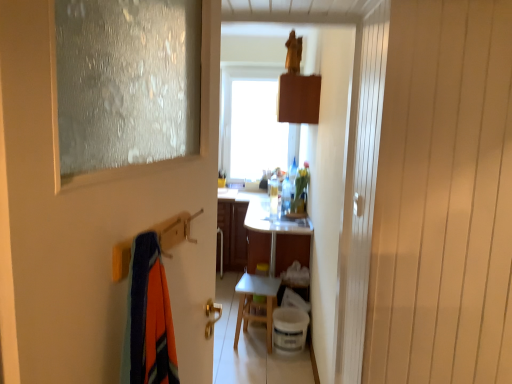
Question: Is translucent plastic bottle at center shorter than frosted glass door at left?

Choices:
 (A) yes
 (B) no

Answer: (A)

Question: From the image's perspective, would you say translucent plastic bottle at center is shown under frosted glass door at left?

Choices:
 (A) yes
 (B) no

Answer: (B)

Question: From the image's perspective, does translucent plastic bottle at center appear higher than frosted glass door at left?

Choices:
 (A) no
 (B) yes

Answer: (B)

Question: Can you confirm if translucent plastic bottle at center is taller than frosted glass door at left?

Choices:
 (A) yes
 (B) no

Answer: (B)

Question: Does translucent plastic bottle at center have a lesser width compared to frosted glass door at left?

Choices:
 (A) no
 (B) yes

Answer: (A)

Question: Is point (281, 200) positioned closer to the camera than point (264, 238)?

Choices:
 (A) closer
 (B) farther

Answer: (B)

Question: From a real-world perspective, is translucent plastic bottle at center positioned above or below white glossy vanity at center?

Choices:
 (A) above
 (B) below

Answer: (A)

Question: In terms of height, does translucent plastic bottle at center look taller or shorter compared to white glossy vanity at center?

Choices:
 (A) tall
 (B) short

Answer: (B)

Question: Is translucent plastic bottle at center to the left or to the right of white glossy vanity at center in the image?

Choices:
 (A) right
 (B) left

Answer: (A)

Question: Is translucent plastic bottle at center in front of or behind white matte table at center in the image?

Choices:
 (A) behind
 (B) front

Answer: (A)

Question: Is translucent plastic bottle at center situated inside white matte table at center or outside?

Choices:
 (A) inside
 (B) outside

Answer: (B)

Question: Is point (287, 195) positioned closer to the camera than point (267, 306)?

Choices:
 (A) closer
 (B) farther

Answer: (B)

Question: From the image's perspective, is translucent plastic bottle at center located above or below white matte table at center?

Choices:
 (A) above
 (B) below

Answer: (A)

Question: From a real-world perspective, is frosted glass door at left positioned above or below white glossy vanity at center?

Choices:
 (A) above
 (B) below

Answer: (A)

Question: From the image's perspective, relative to white glossy vanity at center, is frosted glass door at left above or below?

Choices:
 (A) below
 (B) above

Answer: (B)